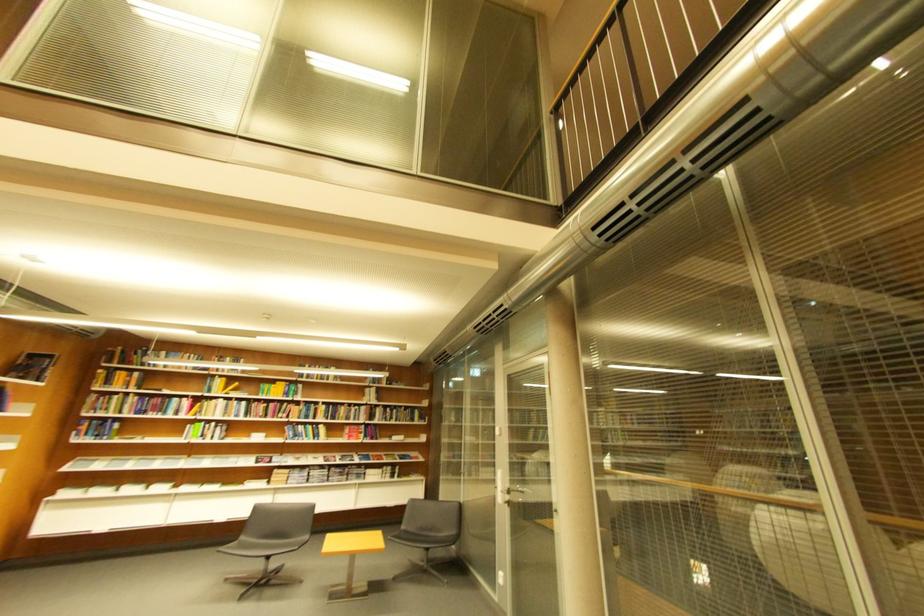
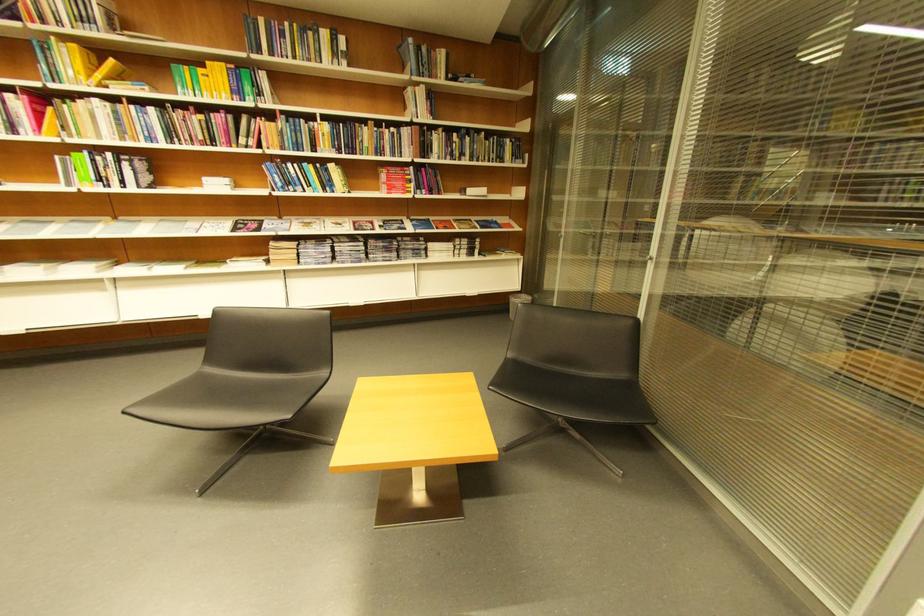
The point at (301, 438) is marked in the first image. Where is the corresponding point in the second image?

(290, 185)